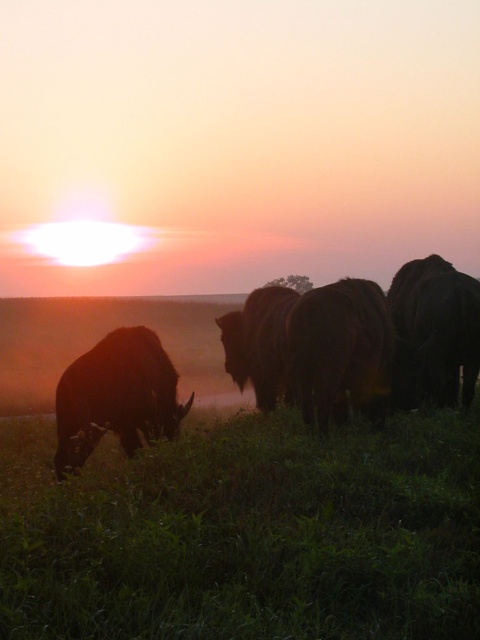
Question: Is green grassy at lower left thinner than dark brown fur at lower left?

Choices:
 (A) no
 (B) yes

Answer: (A)

Question: Is brown fuzzy bison at center to the right of dark brown fur at right from the viewer's perspective?

Choices:
 (A) no
 (B) yes

Answer: (A)

Question: Which point appears farthest from the camera in this image?

Choices:
 (A) (80, 528)
 (B) (84, 413)

Answer: (B)

Question: Which point is farther to the camera?

Choices:
 (A) dark brown fur at lower left
 (B) green grassy at lower left
 (C) brown fuzzy bison at center
 (D) dark brown fur at right

Answer: (D)

Question: Can you confirm if green grassy at lower left is bigger than brown fuzzy bison at center?

Choices:
 (A) yes
 (B) no

Answer: (B)

Question: Which of the following is the closest to the observer?

Choices:
 (A) dark brown fur at right
 (B) green grassy at lower left

Answer: (B)